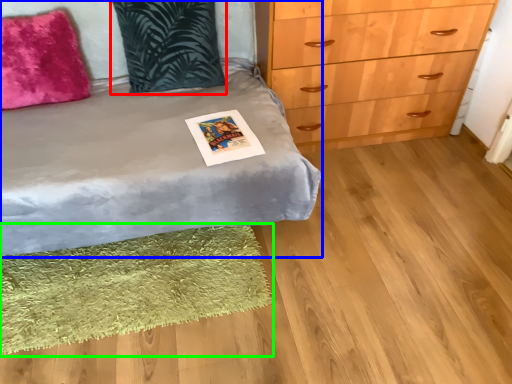
Question: Which is nearer to the pillow (highlighted by a red box)? bed (highlighted by a blue box) or mat (highlighted by a green box).

Choices:
 (A) bed
 (B) mat

Answer: (A)